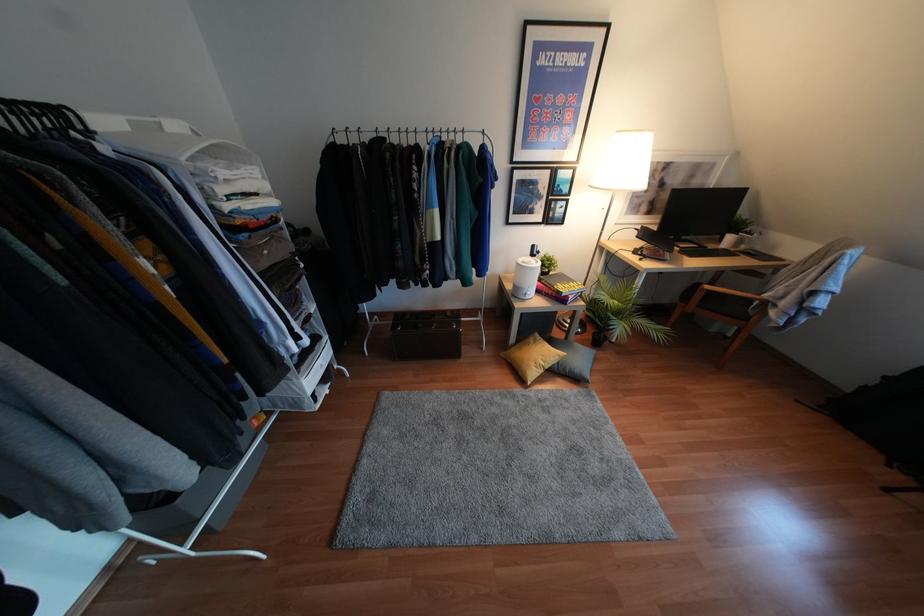
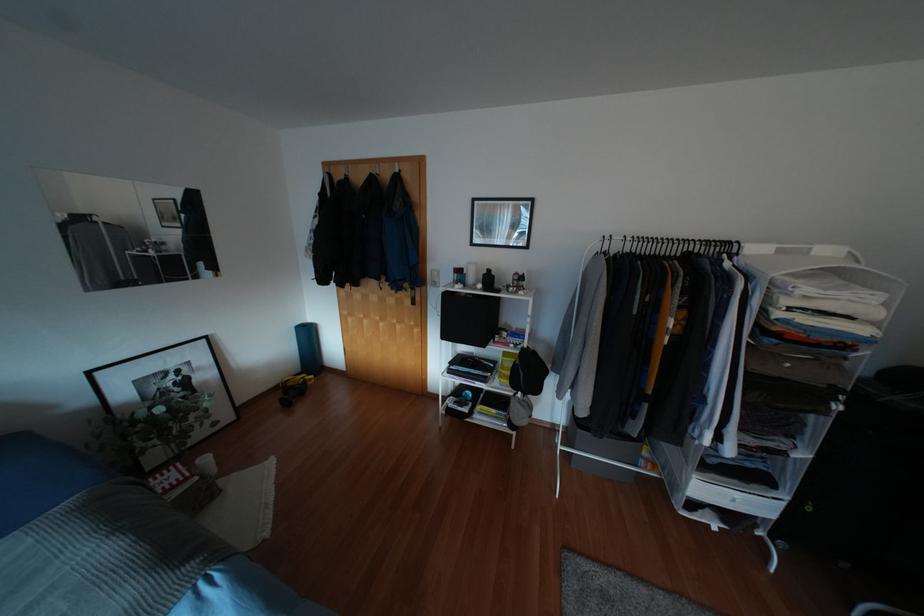
Locate, in the second image, the point that corresponds to point 321,365 in the first image.

(734, 500)